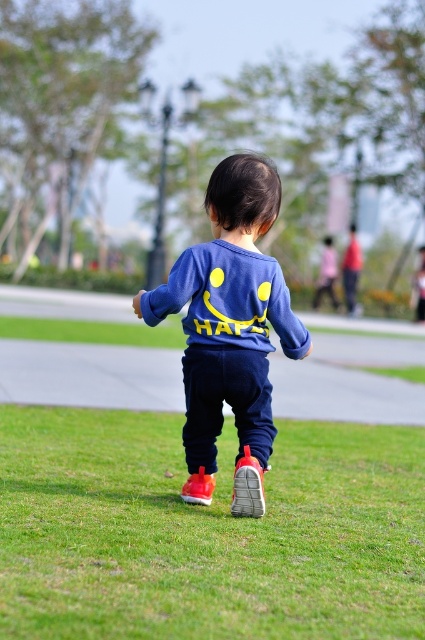
This screenshot has height=640, width=425. What are the coordinates of `green grass at lower center` in the screenshot? It's located at (206, 532).

Is green grass at lower center to the right of blue matte sweatshirt at center from the viewer's perspective?

Indeed, green grass at lower center is positioned on the right side of blue matte sweatshirt at center.

Who is more forward, [56,614] or [241,349]?

Point [56,614] is in front.

You are a GUI agent. You are given a task and a screenshot of the screen. Output one action in this format:
    pyautogui.click(x=<x>, y=<y>)
    Task: Click on the green grass at lower center
    This screenshot has height=640, width=425.
    Given the screenshot: What is the action you would take?
    pyautogui.click(x=206, y=532)